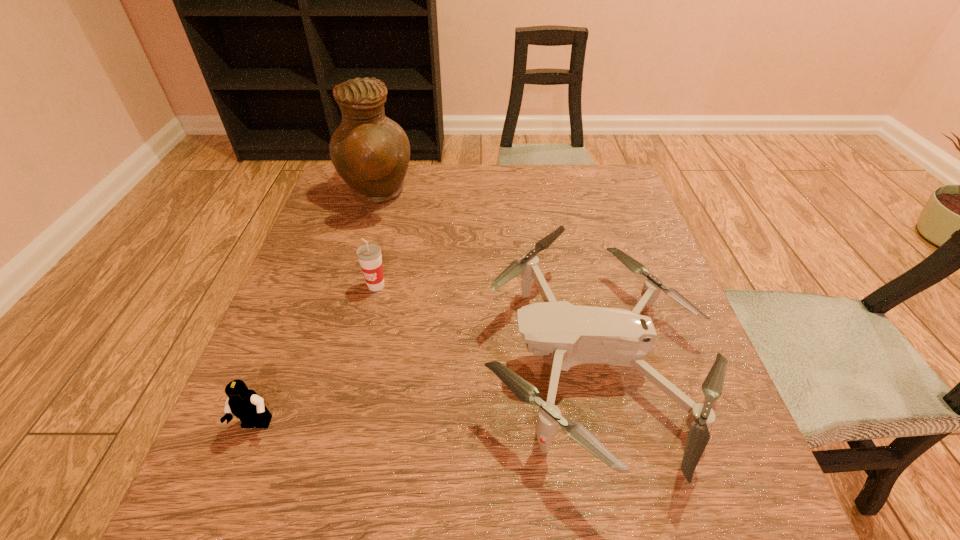
Locate an element on the screen. This screenshot has width=960, height=540. the farthest object is located at coordinates (371, 153).

This screenshot has width=960, height=540. What are the coordinates of `the tallest object` in the screenshot? It's located at (371, 153).

You are a GUI agent. You are given a task and a screenshot of the screen. Output one action in this format:
    pyautogui.click(x=<x>, y=<y>)
    Task: Click on the cup
    The height and width of the screenshot is (540, 960).
    Given the screenshot: What is the action you would take?
    pyautogui.click(x=369, y=255)

The height and width of the screenshot is (540, 960). I want to click on drone, so click(x=575, y=335).

Locate an element on the screen. Image resolution: width=960 pixels, height=540 pixels. Lego is located at coordinates (247, 405).

Find the location of a particular element. The height and width of the screenshot is (540, 960). free space located at the spout of the farthest object is located at coordinates (528, 195).

In order to click on blank space located 0.150m on the side of the cup with the logo in this screenshot , I will do `click(360, 352)`.

Where is `vacant space located with a camera at the front of the rightmost object`? The image size is (960, 540). vacant space located with a camera at the front of the rightmost object is located at coordinates (272, 358).

Locate an element on the screen. The width and height of the screenshot is (960, 540). free region located 0.360m with a camera at the front of the rightmost object is located at coordinates (288, 358).

What are the coordinates of `vacant space situated with a camera at the front of the rightmost object` in the screenshot? It's located at (321, 358).